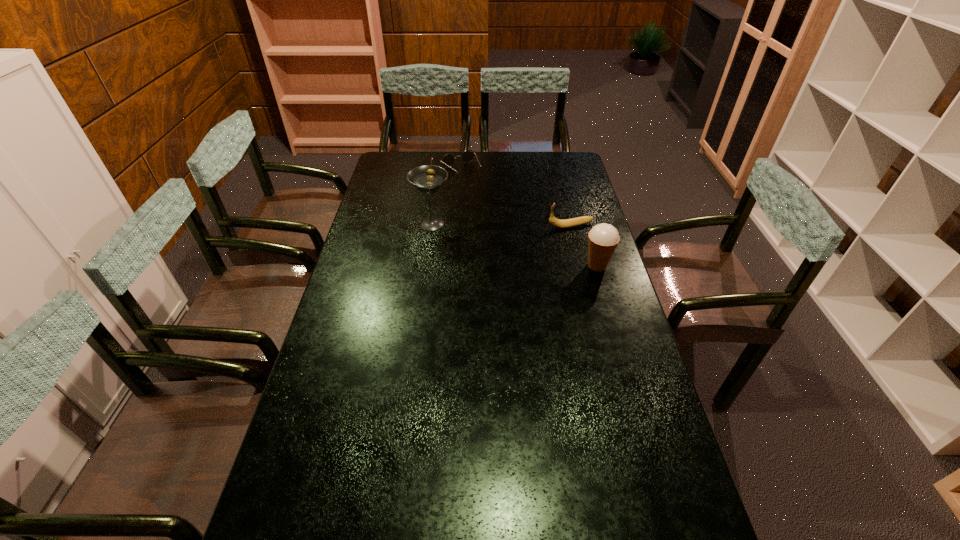
The width and height of the screenshot is (960, 540). Find the location of `the tallest object`. the tallest object is located at coordinates (427, 179).

Locate an element on the screen. The height and width of the screenshot is (540, 960). the third shortest object is located at coordinates (603, 238).

Where is `the nearest object`? The image size is (960, 540). the nearest object is located at coordinates (603, 238).

At what (x,y) coordinates should I click in order to perform the action: click on banana. Please return your answer as a coordinate pair (x, y). The width and height of the screenshot is (960, 540). Looking at the image, I should click on tap(567, 223).

Image resolution: width=960 pixels, height=540 pixels. Find the location of `the shortest object`. the shortest object is located at coordinates (448, 160).

I want to click on the farthest object, so click(x=448, y=160).

At what (x,y) coordinates should I click in order to perform the action: click on vacant space situated on the left of the martini. Please return your answer as a coordinate pair (x, y). Image resolution: width=960 pixels, height=540 pixels. Looking at the image, I should click on (397, 224).

The height and width of the screenshot is (540, 960). I want to click on vacant space situated on the front of the second tallest object, so click(x=615, y=327).

What are the coordinates of `vacant position located 0.130m at the stem of the banana` in the screenshot? It's located at (516, 232).

What are the coordinates of `free space located at the stem of the banana` in the screenshot? It's located at (526, 230).